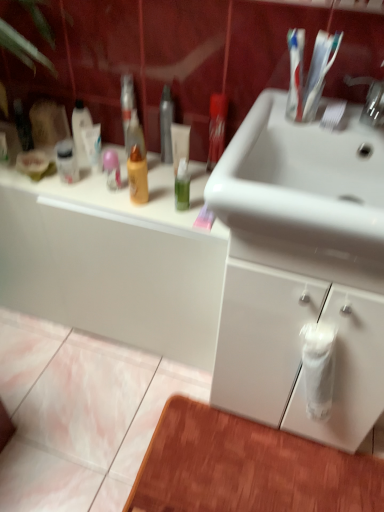
Question: From the image's perspective, would you say white glossy cabinet at lower left, arranged as the 1th bathroom cabinet when viewed from the left, is shown under white glossy sink at upper center?

Choices:
 (A) no
 (B) yes

Answer: (B)

Question: Can you confirm if white glossy cabinet at lower left, which is counted as the second bathroom cabinet, starting from the right, is smaller than white glossy sink at upper center?

Choices:
 (A) yes
 (B) no

Answer: (B)

Question: From the image's perspective, is white glossy cabinet at lower left, which is counted as the second bathroom cabinet, starting from the right, over white glossy sink at upper center?

Choices:
 (A) yes
 (B) no

Answer: (B)

Question: Is white glossy cabinet at lower left, arranged as the 1th bathroom cabinet when viewed from the left, further to camera compared to white glossy sink at upper center?

Choices:
 (A) yes
 (B) no

Answer: (A)

Question: Can you confirm if white glossy cabinet at lower left, arranged as the 1th bathroom cabinet when viewed from the left, is taller than white glossy sink at upper center?

Choices:
 (A) yes
 (B) no

Answer: (A)

Question: Is white glossy cabinet at lower left, arranged as the 1th bathroom cabinet when viewed from the left, next to white glossy sink at upper center and touching it?

Choices:
 (A) no
 (B) yes

Answer: (A)

Question: Is white glossy cabinet at lower right, placed as the 1th bathroom cabinet when sorted from right to left, touching white glossy cabinet at lower left, arranged as the 1th bathroom cabinet when viewed from the left?

Choices:
 (A) yes
 (B) no

Answer: (B)

Question: From the image's perspective, is white glossy cabinet at lower right, arranged as the second bathroom cabinet when viewed from the left, under white glossy cabinet at lower left, which is counted as the second bathroom cabinet, starting from the right?

Choices:
 (A) no
 (B) yes

Answer: (B)

Question: Is white glossy cabinet at lower right, arranged as the second bathroom cabinet when viewed from the left, thinner than white glossy cabinet at lower left, which is counted as the second bathroom cabinet, starting from the right?

Choices:
 (A) no
 (B) yes

Answer: (A)

Question: From a real-world perspective, is white glossy cabinet at lower right, arranged as the second bathroom cabinet when viewed from the left, over white glossy cabinet at lower left, which is counted as the second bathroom cabinet, starting from the right?

Choices:
 (A) yes
 (B) no

Answer: (A)

Question: Is white glossy cabinet at lower left, which is counted as the second bathroom cabinet, starting from the right, surrounded by white glossy cabinet at lower right, placed as the 1th bathroom cabinet when sorted from right to left?

Choices:
 (A) yes
 (B) no

Answer: (B)

Question: Considering the relative positions of white glossy cabinet at lower right, placed as the 1th bathroom cabinet when sorted from right to left, and white glossy cabinet at lower left, which is counted as the second bathroom cabinet, starting from the right, in the image provided, is white glossy cabinet at lower right, placed as the 1th bathroom cabinet when sorted from right to left, to the left of white glossy cabinet at lower left, which is counted as the second bathroom cabinet, starting from the right, from the viewer's perspective?

Choices:
 (A) no
 (B) yes

Answer: (A)

Question: Is white glossy sink at upper center outside of white glossy cabinet at lower right, placed as the 1th bathroom cabinet when sorted from right to left?

Choices:
 (A) yes
 (B) no

Answer: (A)